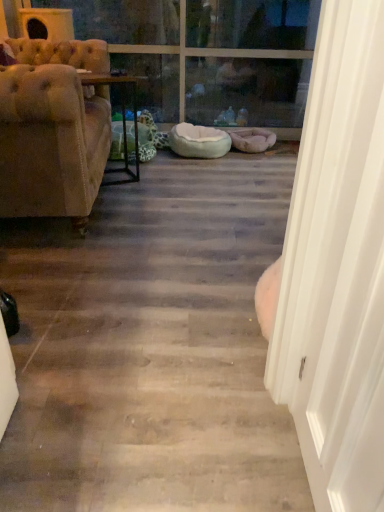
Question: From the image's perspective, is white smooth door at right below tufted beige fabric couch at left?

Choices:
 (A) no
 (B) yes

Answer: (B)

Question: Is white smooth door at right turned away from tufted beige fabric couch at left?

Choices:
 (A) yes
 (B) no

Answer: (B)

Question: Considering the relative sizes of white smooth door at right and tufted beige fabric couch at left in the image provided, is white smooth door at right shorter than tufted beige fabric couch at left?

Choices:
 (A) no
 (B) yes

Answer: (A)

Question: Is the position of white smooth door at right less distant than that of tufted beige fabric couch at left?

Choices:
 (A) yes
 (B) no

Answer: (A)

Question: Does white smooth door at right appear on the right side of tufted beige fabric couch at left?

Choices:
 (A) no
 (B) yes

Answer: (B)

Question: Which is correct: light blue plush dog bed at center is inside wooden table at center, or outside of it?

Choices:
 (A) outside
 (B) inside

Answer: (A)

Question: Considering the positions of light blue plush dog bed at center and wooden table at center in the image, is light blue plush dog bed at center taller or shorter than wooden table at center?

Choices:
 (A) tall
 (B) short

Answer: (B)

Question: From the image's perspective, is light blue plush dog bed at center above or below wooden table at center?

Choices:
 (A) below
 (B) above

Answer: (B)

Question: In terms of width, does light blue plush dog bed at center look wider or thinner when compared to wooden table at center?

Choices:
 (A) thin
 (B) wide

Answer: (B)

Question: In terms of size, does wooden table at center appear bigger or smaller than transparent glass door at upper center?

Choices:
 (A) big
 (B) small

Answer: (A)

Question: Is wooden table at center wider or thinner than transparent glass door at upper center?

Choices:
 (A) thin
 (B) wide

Answer: (A)

Question: Is point (132, 177) positioned closer to the camera than point (281, 55)?

Choices:
 (A) closer
 (B) farther

Answer: (A)

Question: From a real-world perspective, is wooden table at center above or below transparent glass door at upper center?

Choices:
 (A) below
 (B) above

Answer: (A)

Question: From the image's perspective, relative to white smooth door at right, is transparent glass door at upper center above or below?

Choices:
 (A) above
 (B) below

Answer: (A)

Question: In terms of height, does transparent glass door at upper center look taller or shorter compared to white smooth door at right?

Choices:
 (A) short
 (B) tall

Answer: (A)